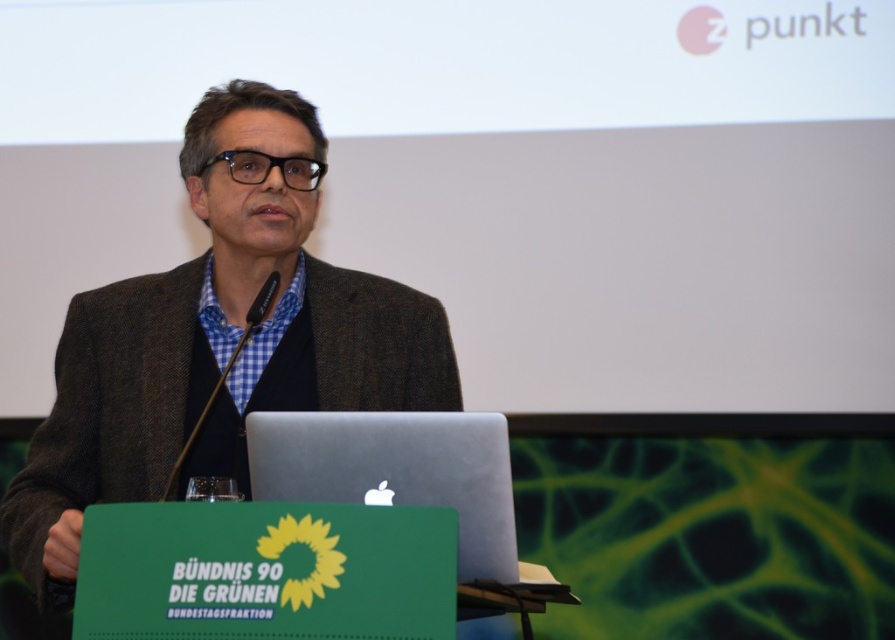
You are a photographer setting up for a speech event. You need to ensure there is enough space between the brown woolen jacket at center and the silver metallic laptop at center so that your camera can capture both without any obstruction. The minimum required distance between them for your equipment is 14 inches. Based on the scene, is the current spacing sufficient?

The brown woolen jacket at center and the silver metallic laptop at center are 14.48 inches apart from each other, which is more than the required 14 inches. Therefore, the current spacing is sufficient for the camera to capture both items without obstruction.

You are a photographer adjusting your camera settings to capture the man and the podium clearly. You notice two points of interest marked at coordinates point (146, 349) and point (501, 509). Which point is closer to your camera lens?

Point (146, 349) is closer to the camera lens than point (501, 509) because it is further to the viewer according to the description.